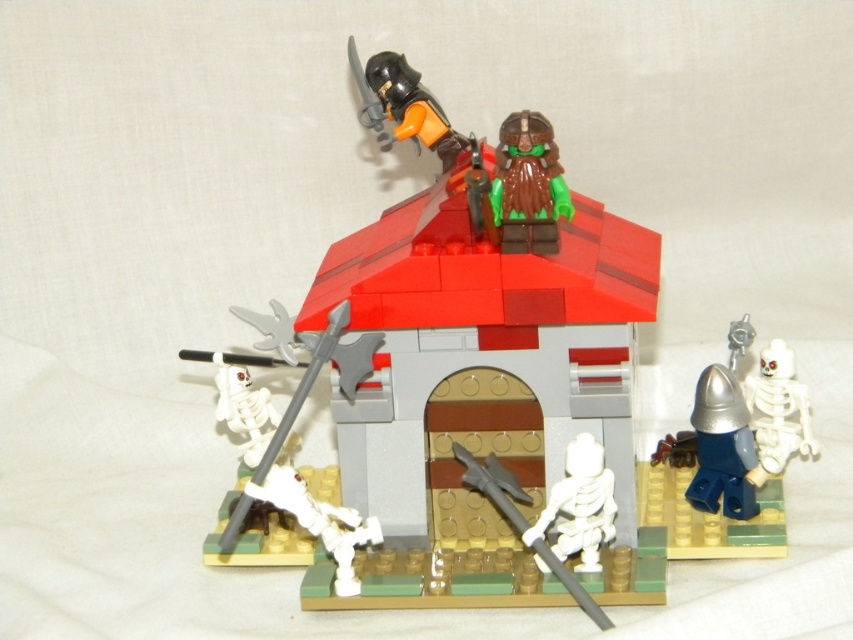
You are a visitor looking at this LEGO diorama. You notice the metallic silver helmet at lower right and the white matte skeleton at lower center. Which object is positioned more to the right side of the scene?

The metallic silver helmet at lower right is positioned to the right of the white matte skeleton at lower center, so the metallic silver helmet at lower right is more to the right side of the scene.